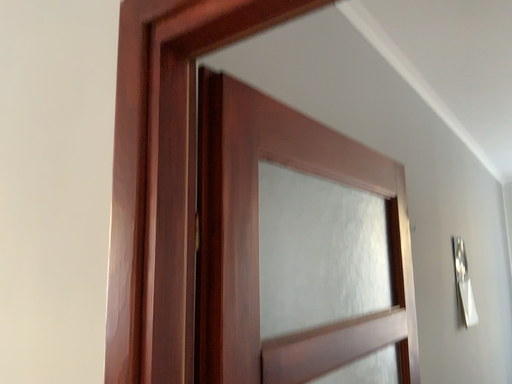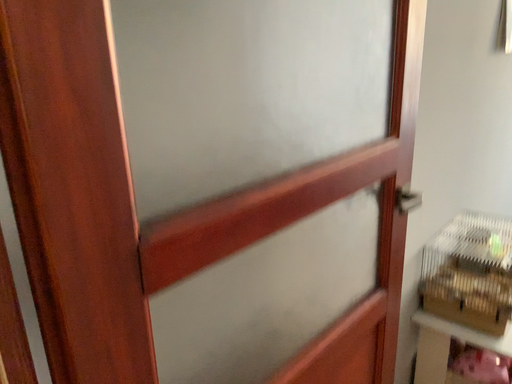
Question: How did the camera likely rotate when shooting the video?

Choices:
 (A) rotated upward
 (B) rotated downward

Answer: (B)